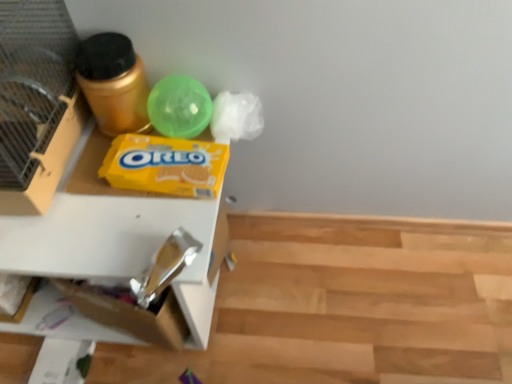
Question: Is brushed metal bird cage at left bigger or smaller than yellow cardboard oreo box at center?

Choices:
 (A) big
 (B) small

Answer: (A)

Question: Does point (48, 39) appear closer or farther from the camera than point (159, 162)?

Choices:
 (A) closer
 (B) farther

Answer: (B)

Question: Based on their relative distances, which object is nearer to the gold metallic canister at upper left?

Choices:
 (A) white cardboard drawer at left
 (B) wooden floor at lower right
 (C) translucent green ball at upper center
 (D) brushed metal bird cage at left
 (E) yellow cardboard oreo box at center

Answer: (C)

Question: Estimate the real-world distances between objects in this image. Which object is farther from the white cardboard drawer at left?

Choices:
 (A) translucent green ball at upper center
 (B) gold metallic canister at upper left
 (C) wooden floor at lower right
 (D) yellow cardboard oreo box at center
 (E) brushed metal bird cage at left

Answer: (C)